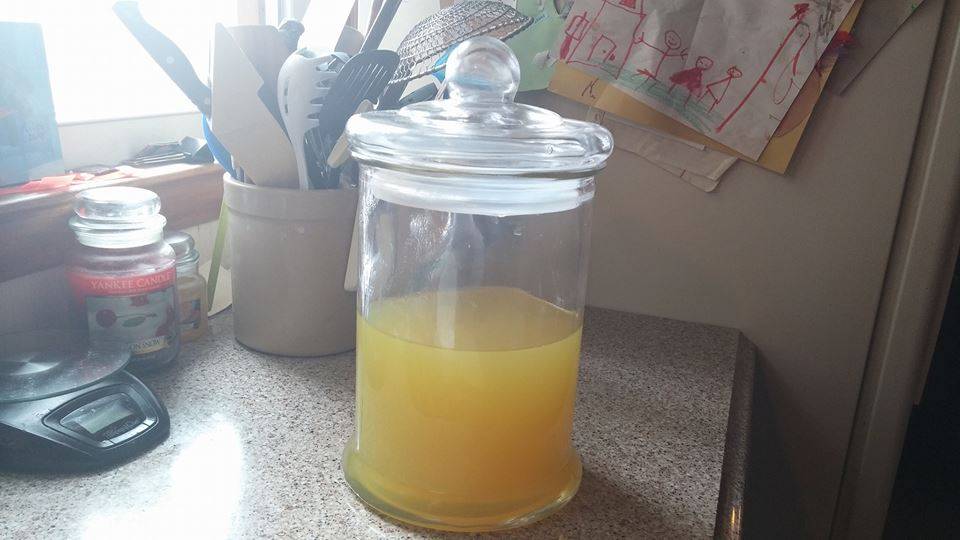
Where is `1 windowsill`? 1 windowsill is located at coordinates (120, 109).